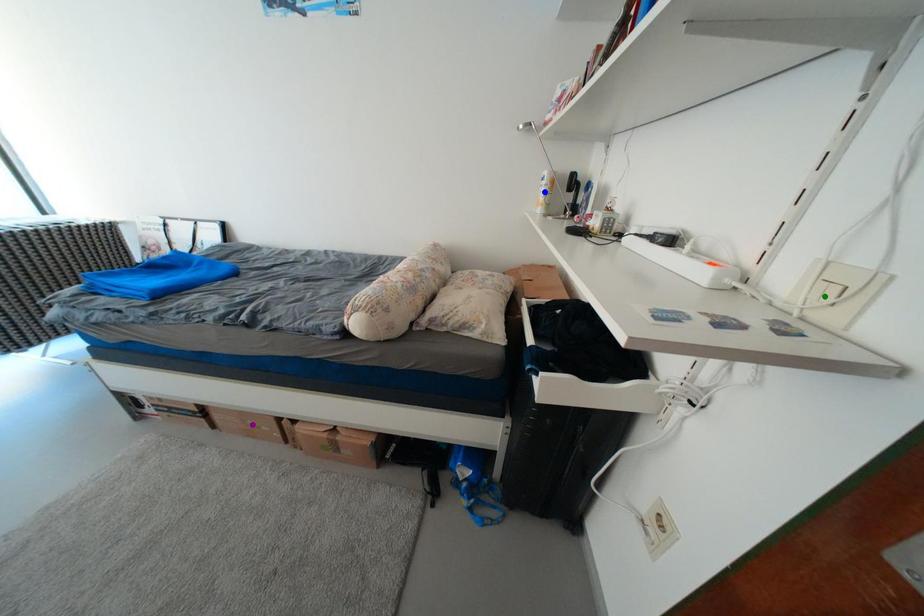
From the picture: Order these from nearest to farthest:
A) purple point
B) blue point
C) green point

green point → purple point → blue point